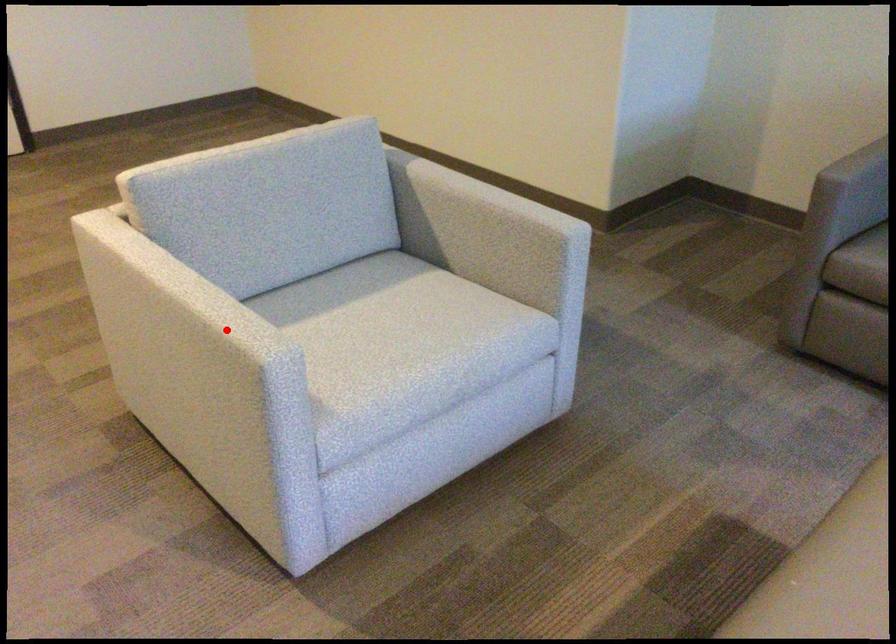
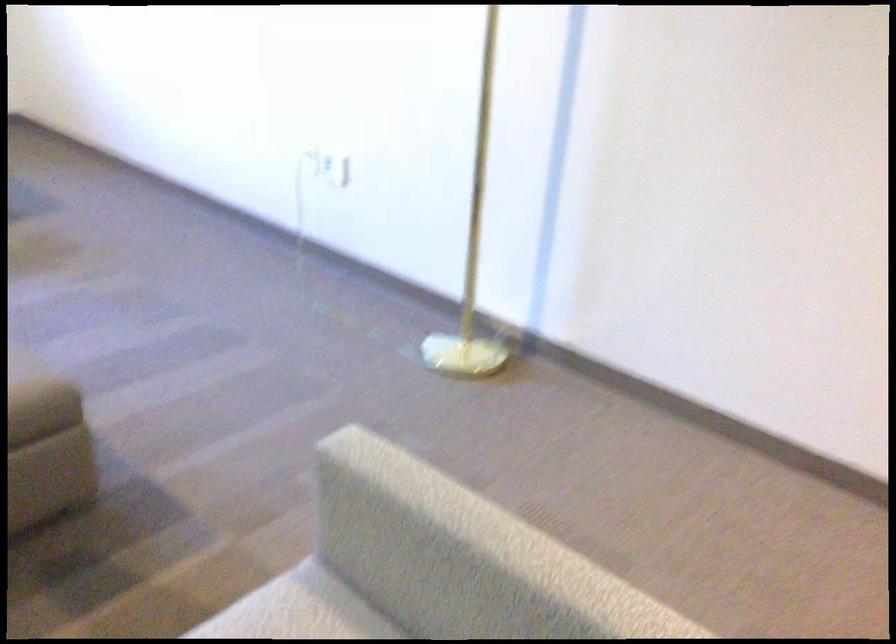
Locate, in the second image, the point that corresponds to the highlighted location in the first image.

(421, 489)